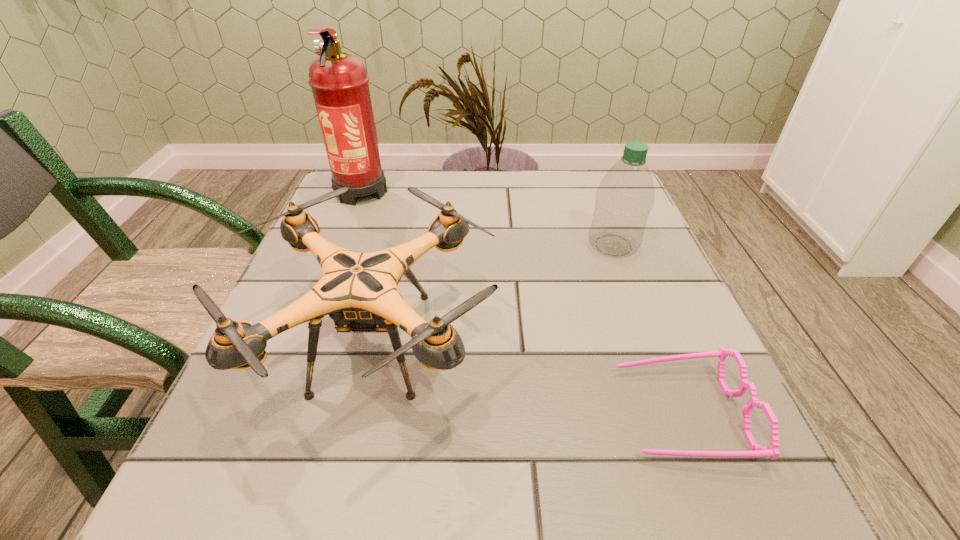
Locate an element on the screen. The height and width of the screenshot is (540, 960). fire extinguisher is located at coordinates (339, 82).

Image resolution: width=960 pixels, height=540 pixels. Identify the location of the tallest object. (339, 82).

This screenshot has height=540, width=960. Find the location of `water bottle`. water bottle is located at coordinates (625, 196).

What are the coordinates of `the third tallest object` in the screenshot? It's located at (358, 290).

Locate an element on the screen. the shortest object is located at coordinates (771, 451).

You are a GUI agent. You are given a task and a screenshot of the screen. Output one action in this format:
    pyautogui.click(x=<x>, y=<y>)
    Task: Click on the vacant position located on the front-facing side of the fire extinguisher
    
    Given the screenshot: What is the action you would take?
    pyautogui.click(x=337, y=253)

Locate an element on the screen. This screenshot has width=960, height=540. vacant point located 0.180m on the front of the second farthest object is located at coordinates (644, 326).

At what (x,y) coordinates should I click in order to perform the action: click on free space located 0.220m on the camera mount of the third tallest object. Please return your answer as a coordinate pair (x, y). The image size is (960, 540). Looking at the image, I should click on (625, 342).

Locate an element on the screen. The image size is (960, 540). free space located on the arms of the shortest object is located at coordinates (481, 413).

Find the location of a particular element. vacant space located 0.390m on the arms of the shortest object is located at coordinates pyautogui.click(x=357, y=413).